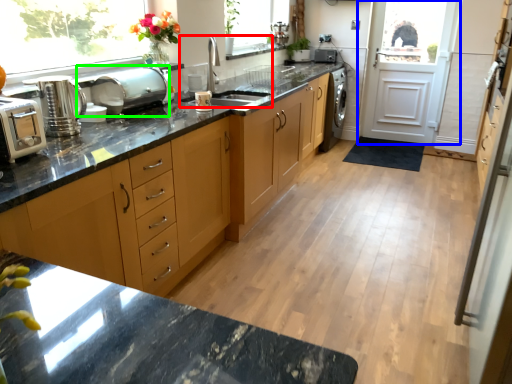
Question: Considering the real-world distances, which object is closest to sink (highlighted by a red box)? door (highlighted by a blue box) or appliance (highlighted by a green box).

Choices:
 (A) door
 (B) appliance

Answer: (B)